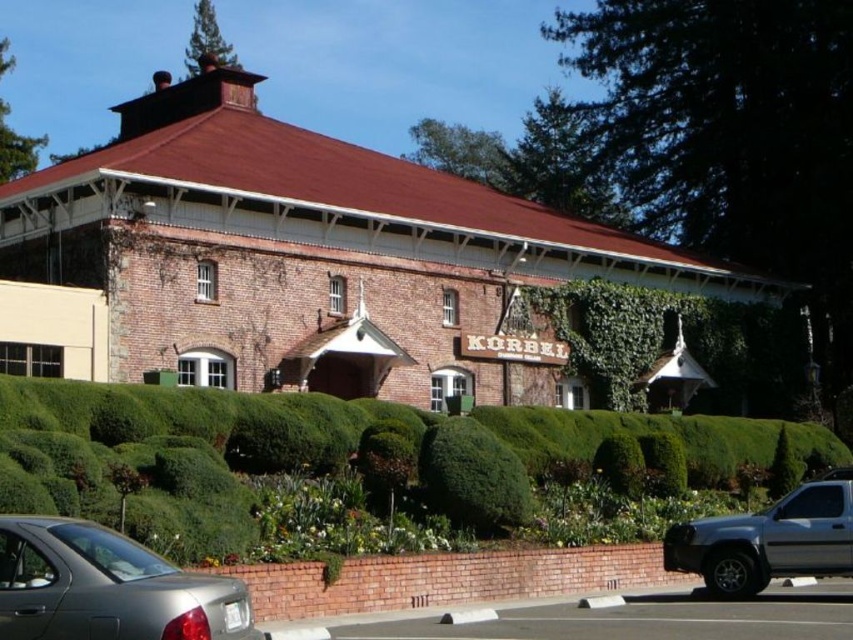
Looking at this image, you are standing in front of the KORBEL building and want to take a photo of both the green leafy hedge at center and the green leafy bush at center. Which one should you focus on first to ensure both are in clear view?

You should focus on the green leafy hedge at center first because it is closer to the viewer, ensuring both it and the green leafy bush at center remain in clear view.

You are a visitor arriving at the KORBEL building and need to park your car. You see a satin silver sedan at lower left and a silver metallic truck at lower right. Which parking spot is closer to the entrance of the building?

The satin silver sedan at lower left is positioned on the left side of the silver metallic truck at lower right, so the satin silver sedan at lower left is closer to the entrance of the building.